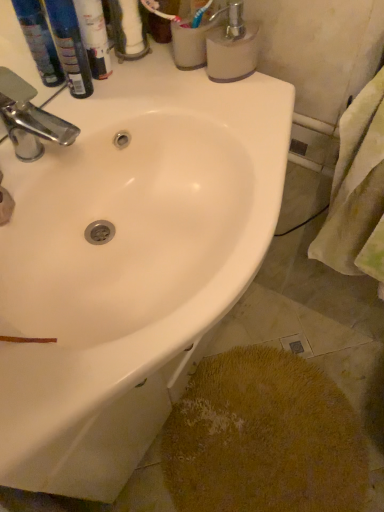
Find the location of a particular element. vacant area that is situated to the right of blue plastic bottles at upper left, marked as the first toiletry in a left-to-right arrangement is located at coordinates (147, 88).